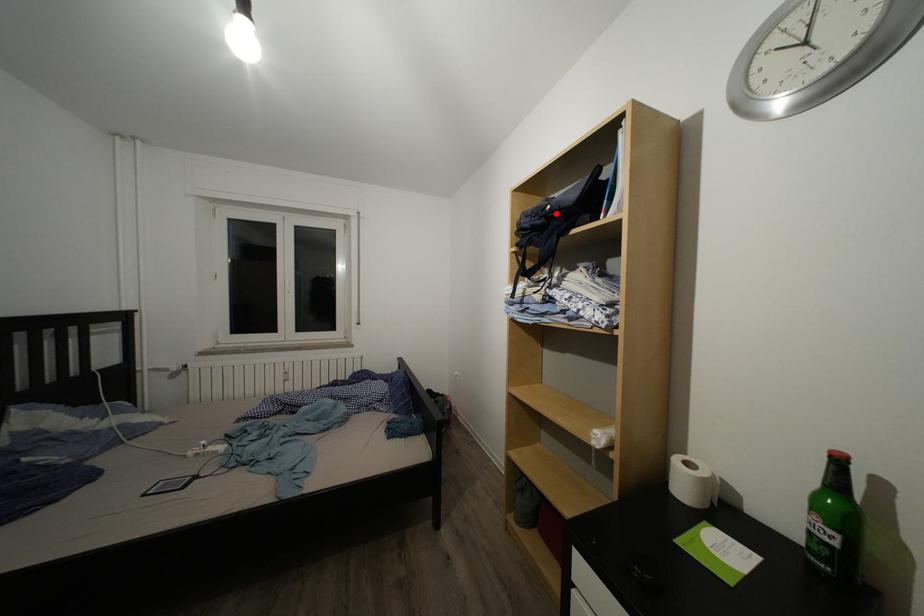
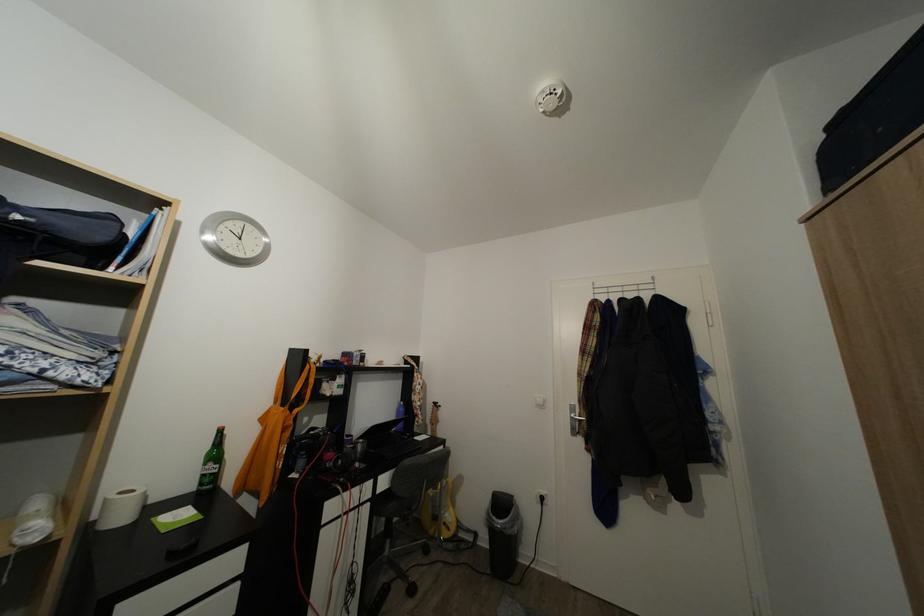
Find the pixel in the second image that matches the highlighted location in the first image.

(25, 223)